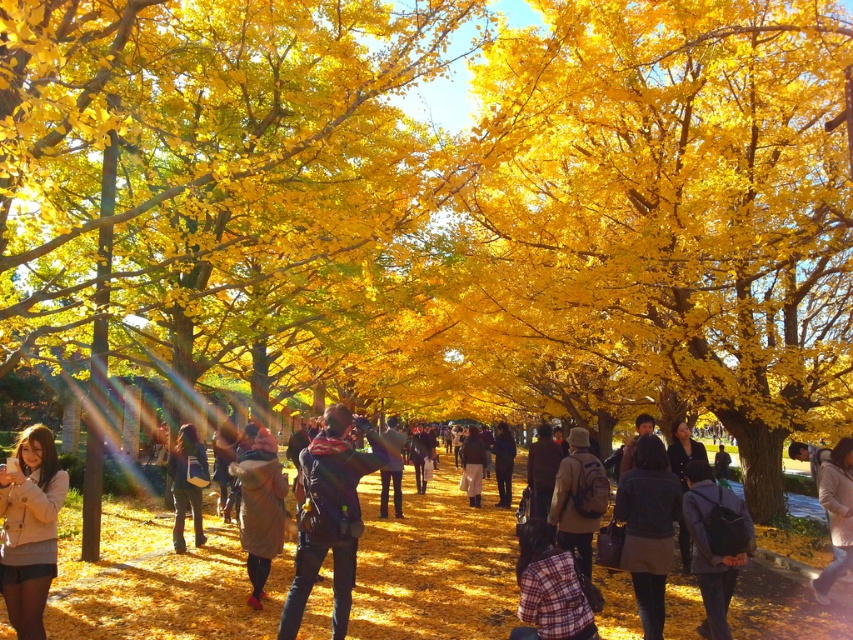
You are standing on the pathway in the autumn scene and want to take a photo of the velvet brown coat at center and the golden leafy tree at center. Which object should you position to the right side of your camera frame to include both in the photo?

You should position the golden leafy tree at center to the right side of your camera frame because the golden leafy tree at center is to the right of the velvet brown coat at center.

You are a photographer planning to take a photo of the golden leafy tree at center and the velvet brown coat at center. Since you want both subjects to be clearly visible, which one should you focus on first to ensure proper exposure?

The golden leafy tree at center is larger in size than the velvet brown coat at center, so you should focus on the golden leafy tree at center first to ensure proper exposure.

You are a photographer trying to capture a shot of both the velvet brown coat at center and the matte black jacket at center. Since you want to highlight the size difference between them, which one should you zoom in on more to make the smaller one appear larger in the photo?

The velvet brown coat at center is smaller than the matte black jacket at center, so you should zoom in more on the velvet brown coat at center to make it appear larger relative to the matte black jacket at center in the photo.